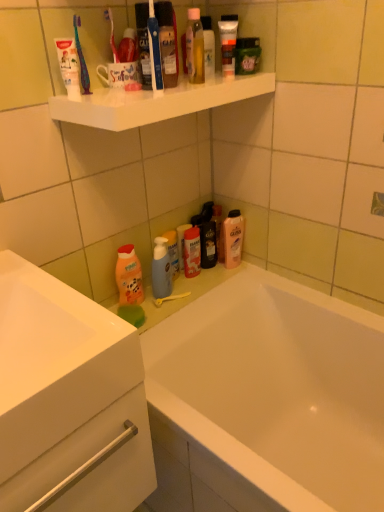
Question: Looking at their shapes, would you say translucent plastic pump bottle at lower center, the fourth toiletry when ordered from right to left, is wider or thinner than matte plastic tube at upper center, positioned as the 4th toiletry in back-to-front order?

Choices:
 (A) thin
 (B) wide

Answer: (A)

Question: From a real-world perspective, is translucent plastic pump bottle at lower center, the fourth toiletry when ordered from right to left, positioned above or below matte plastic tube at upper center, which is the third toiletry from bottom to top?

Choices:
 (A) above
 (B) below

Answer: (B)

Question: Which of these objects is positioned closest to the white matte toothpaste at upper left?

Choices:
 (A) translucent plastic pump bottle at lower center, the 1th toiletry viewed from the left
 (B) white glossy cabinet at lower left
 (C) orange matte bottle at lower left
 (D) translucent plastic toothbrush at upper left
 (E) green matte soap at upper right, the fourth toiletry in the bottom-to-top sequence

Answer: (D)

Question: Considering the real-world distances, which object is closest to the white glossy cabinet at lower left?

Choices:
 (A) green matte soap at upper right, the fourth toiletry when ordered from left to right
 (B) translucent plastic pump bottle at lower center, the 1th toiletry viewed from the left
 (C) white glossy shelf at upper center
 (D) matte plastic tube at upper center, marked as the 2th toiletry in a top-to-bottom arrangement
 (E) white glossy bathtub at lower center

Answer: (E)